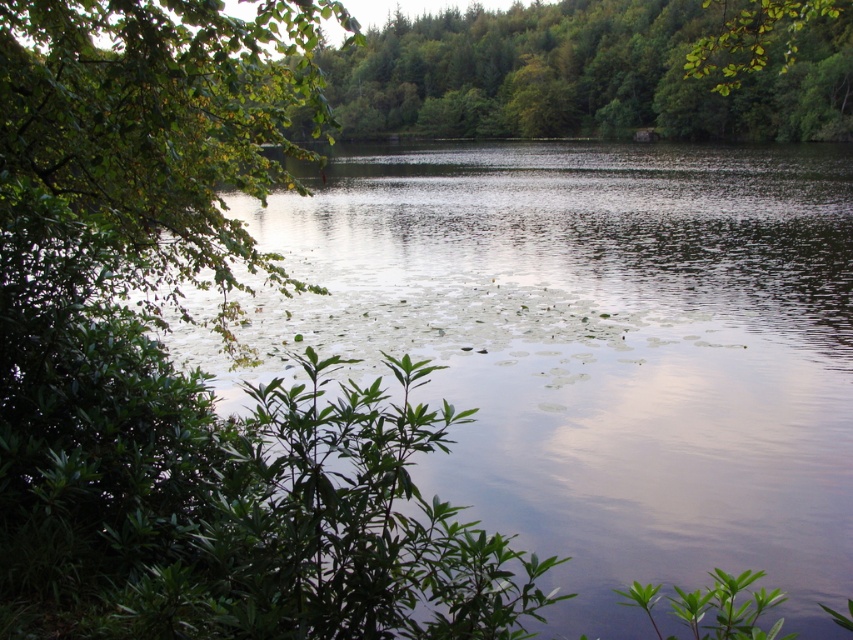
Does green leafy river at left have a lesser width compared to green leafy tree at center?

Yes.

Is point (451, 148) closer to camera compared to point (447, 113)?

Yes, it is in front of point (447, 113).

Where is `green leafy river at left`? The height and width of the screenshot is (640, 853). green leafy river at left is located at coordinates (595, 348).

Between green leafy tree at left and green leafy tree at center, which one is positioned lower?

green leafy tree at left

Locate an element on the screen. The height and width of the screenshot is (640, 853). green leafy tree at left is located at coordinates (154, 128).

Is point (296, 150) in front of point (688, 16)?

That is True.

Where is `green leafy tree at left`? This screenshot has width=853, height=640. green leafy tree at left is located at coordinates (154, 128).

Does green leafy river at left have a smaller size compared to green leafy tree at left?

No, green leafy river at left is not smaller than green leafy tree at left.

What do you see at coordinates (595, 348) in the screenshot? I see `green leafy river at left` at bounding box center [595, 348].

Which is behind, point (432, 221) or point (112, 285)?

The point (432, 221) is more distant.

You are a GUI agent. You are given a task and a screenshot of the screen. Output one action in this format:
    pyautogui.click(x=<x>, y=<y>)
    Task: Click on the green leafy river at left
    This screenshot has height=640, width=853.
    Given the screenshot: What is the action you would take?
    595,348